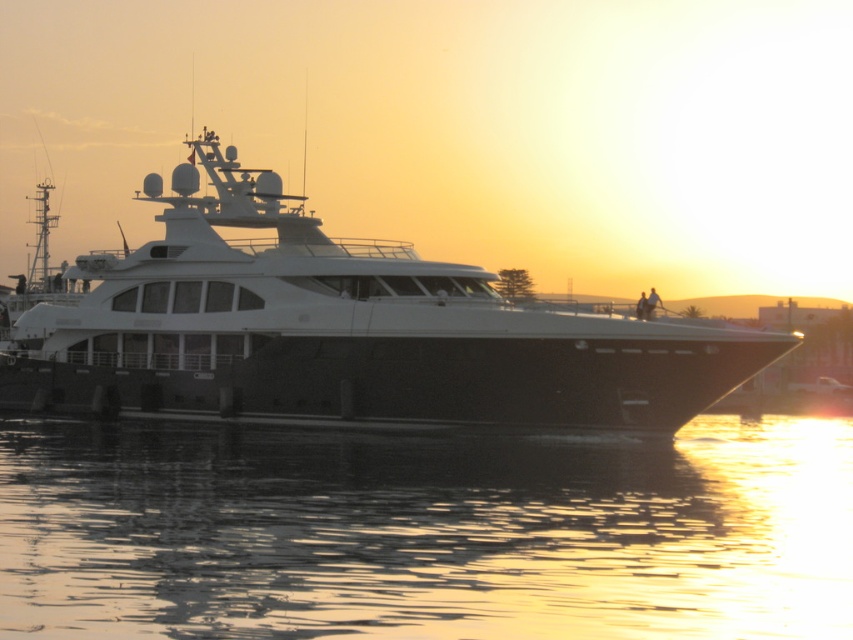
Who is more distant from viewer, (173,545) or (683,419)?

The point (683,419) is behind.

Does glistening water at lower center have a greater width compared to white glossy yacht at center?

No, glistening water at lower center is not wider than white glossy yacht at center.

What do you see at coordinates (425, 532) in the screenshot? The height and width of the screenshot is (640, 853). I see `glistening water at lower center` at bounding box center [425, 532].

Image resolution: width=853 pixels, height=640 pixels. Identify the location of glistening water at lower center. (425, 532).